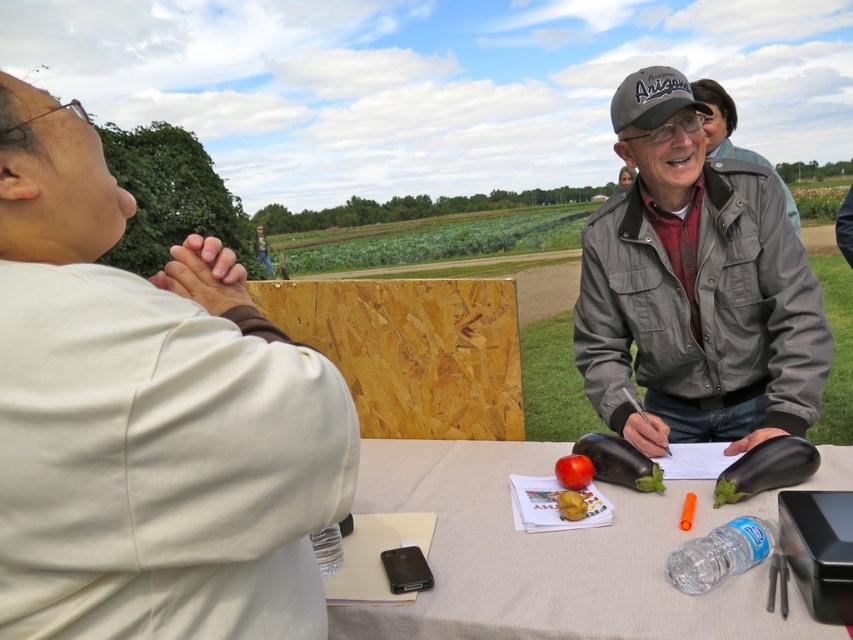
Consider the image. You are a fashion designer observing the scene. You need to determine which item has a greater width between the white matte shirt at upper left and the red matte tomato at center. Which one is wider?

The white matte shirt at upper left is wider than the red matte tomato at center.

In the scene shown: You are a photographer trying to capture a portrait of the two people at the table. The white matte shirt at upper left and the white fabric table at center are both white. Which one appears narrower in the photo?

The white matte shirt at upper left appears narrower in the photo compared to the white fabric table at center because it has a lesser width according to the description.